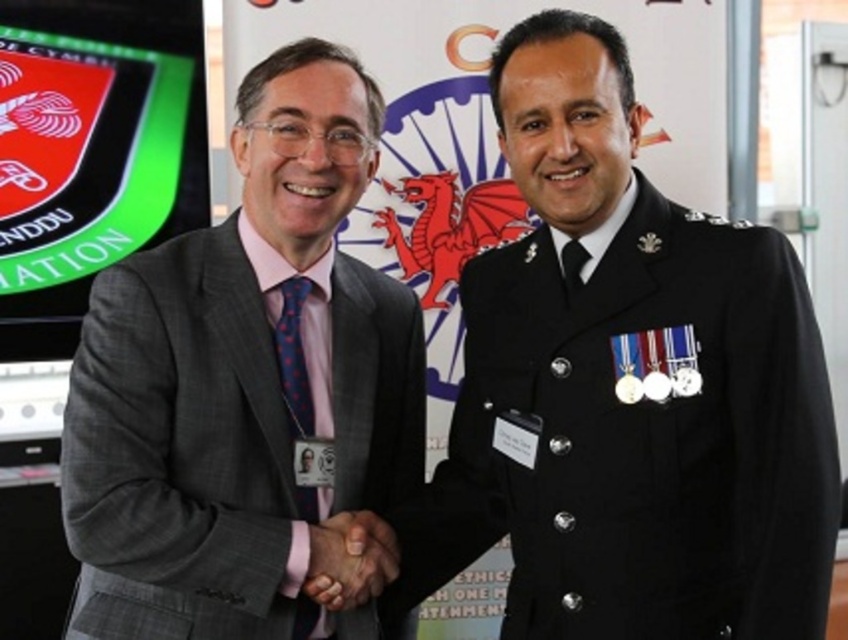
Based on the photo, you are an observer at the event and need to describe the scene. Which object is positioned higher in the image between the black uniform at center and the matte black hands at center?

The black uniform at center is positioned higher than the matte black hands at center in the image.

You are an event photographer at a formal event. You need to capture a photo of the two individuals shaking hands. The matte black hands at center and the black satin tie at right are in your frame. According to the scene, which object is positioned to the left of the other?

The matte black hands at center are to the left of the black satin tie at right.

You are a photographer at a formal event and need to ensure that both ties are visible in the photo. The camera frame can only accommodate objects up to the size of the blue dotted tie at center. Will the black satin tie at right fit within the frame?

The blue dotted tie at center is bigger than the black satin tie at right, so the black satin tie at right will fit within the camera frame since it is smaller in size.